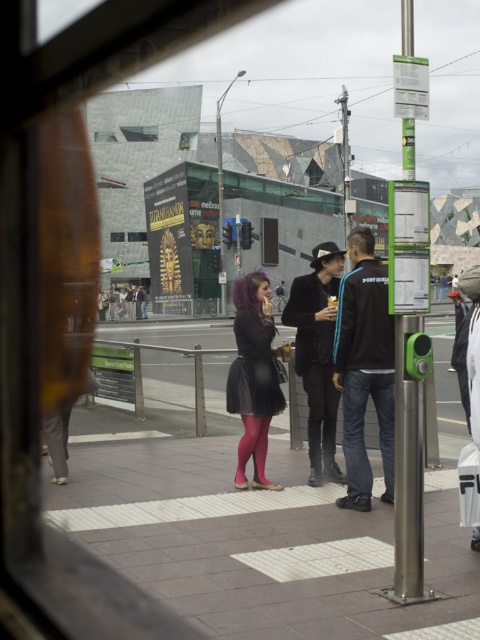
This screenshot has width=480, height=640. I want to click on smooth concrete pavement at center, so click(x=257, y=544).

Who is higher up, smooth concrete pavement at center or matte black dress at center?

matte black dress at center is above.

Locate an element on the screen. This screenshot has width=480, height=640. smooth concrete pavement at center is located at coordinates (257, 544).

Who is higher up, matte black jacket at center or matte black dress at center?

matte black jacket at center

The height and width of the screenshot is (640, 480). What do you see at coordinates (317, 355) in the screenshot? I see `matte black jacket at center` at bounding box center [317, 355].

Find the location of a particular element. The width and height of the screenshot is (480, 640). matte black jacket at center is located at coordinates (317, 355).

Can you confirm if matte black jacket at center is bigger than polished metal pole at right?

No, matte black jacket at center is not bigger than polished metal pole at right.

Between point (331, 339) and point (397, 512), which one is positioned behind?

Point (331, 339)

From the picture: Measure the distance between matte black jacket at center and camera.

matte black jacket at center and camera are 6.31 meters apart.

Where is `matte black jacket at center`? matte black jacket at center is located at coordinates (317, 355).